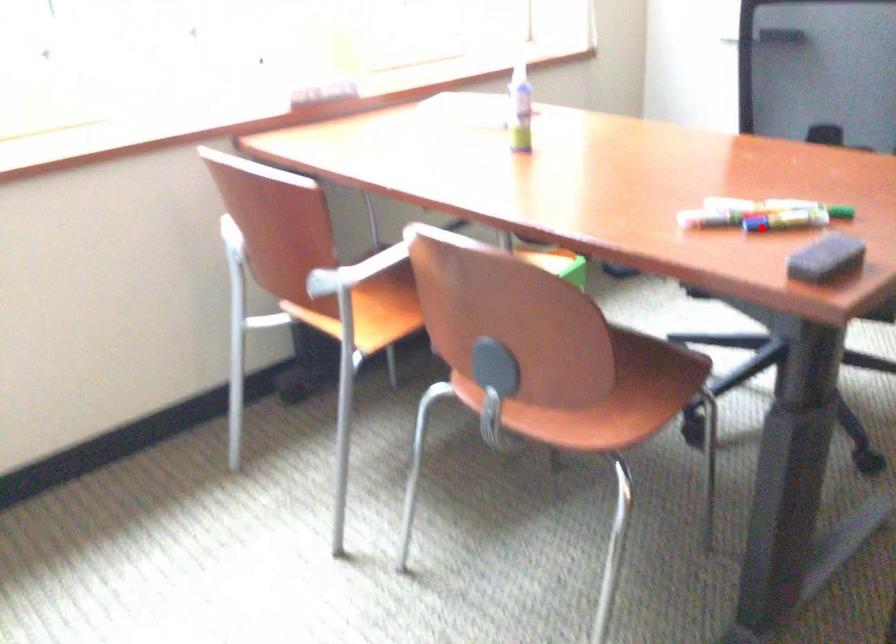
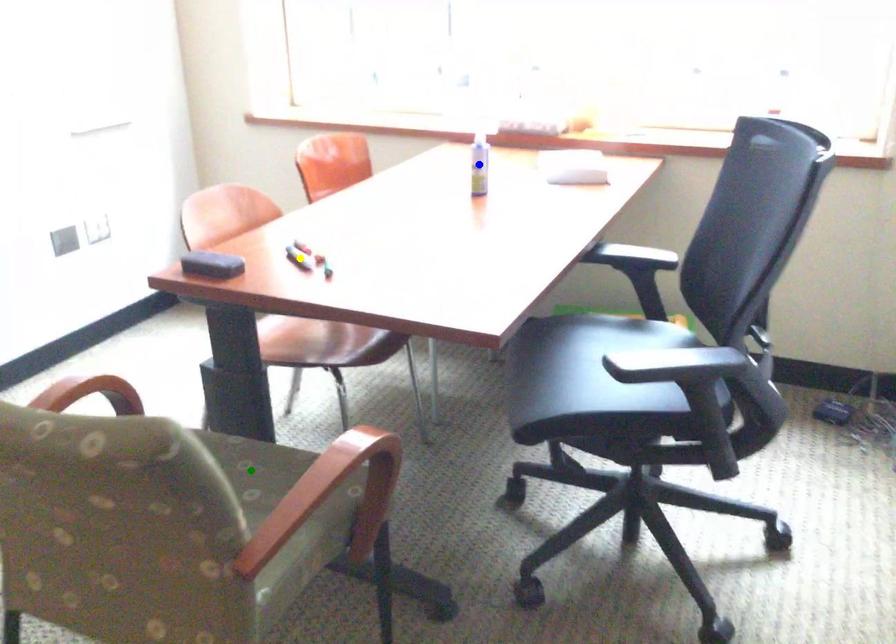
Question: I am providing you with two images of the same scene from different viewpoints. A red point is marked on the first image. You are given multiple points on the second image. In image 2, which mark is for the same physical point as the one in image 1?

Choices:
 (A) green point
 (B) yellow point
 (C) blue point

Answer: (B)